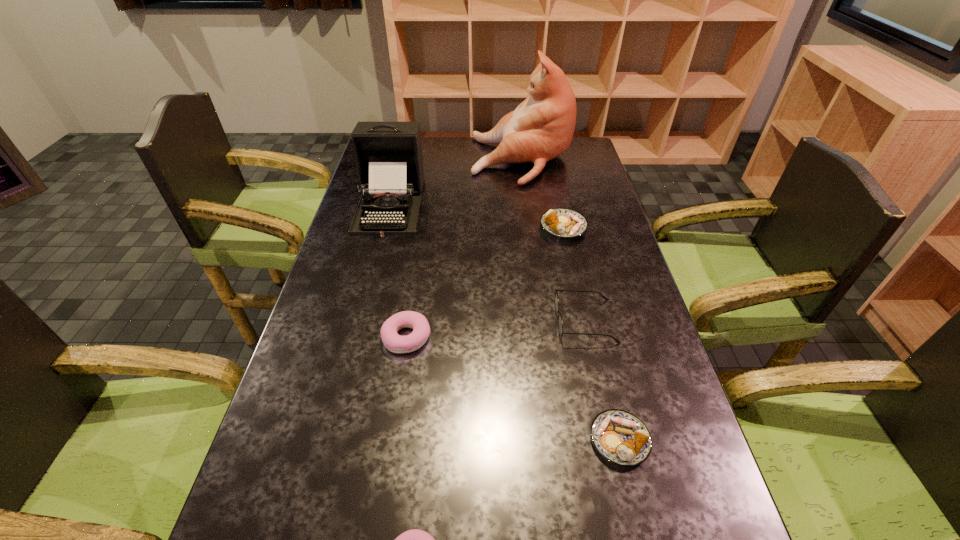
Identify the location of vacant position located 0.250m on the face of the orange cat. This screenshot has width=960, height=540. click(x=406, y=160).

Find the location of a particular element. The image size is (960, 540). free space located 0.120m on the face of the orange cat is located at coordinates (440, 160).

At what (x,y) coordinates should I click in order to perform the action: click on free space located 0.370m on the face of the orange cat. Please return your answer as a coordinate pair (x, y). Looking at the image, I should click on (374, 160).

Locate an element on the screen. The height and width of the screenshot is (540, 960). vacant space situated 0.200m inside the open case of the typewriter is located at coordinates (x=371, y=280).

At what (x,y) coordinates should I click in order to perform the action: click on blank space located on the back of the farthest pastry. Please return your answer as a coordinate pair (x, y). Looking at the image, I should click on (558, 201).

Image resolution: width=960 pixels, height=540 pixels. I want to click on vacant space located on the front-facing side of the spectacles, so click(449, 321).

At what (x,y) coordinates should I click in order to perform the action: click on vacant region located on the front-facing side of the spectacles. Please return your answer as a coordinate pair (x, y). Image resolution: width=960 pixels, height=540 pixels. Looking at the image, I should click on (457, 321).

Where is `free point located on the front-facing side of the spectacles`? free point located on the front-facing side of the spectacles is located at coordinates (496, 321).

You are a GUI agent. You are given a task and a screenshot of the screen. Output one action in this format:
    pyautogui.click(x=<x>, y=<y>)
    Task: Click on the vacant space located 0.100m on the left of the farther pink pastry
    This screenshot has width=960, height=540.
    Given the screenshot: What is the action you would take?
    pyautogui.click(x=341, y=337)

Find the location of a particular element. The width and height of the screenshot is (960, 540). free region located on the left of the smaller brown pastry is located at coordinates (500, 440).